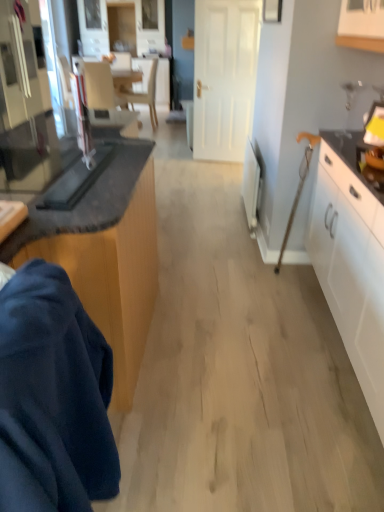
Question: From a real-world perspective, is matte gray armchair at upper left over white plastic radiator at right, the 2th appliance from the front?

Choices:
 (A) yes
 (B) no

Answer: (A)

Question: Does matte gray armchair at upper left touch white plastic radiator at right, the 2th appliance from the front?

Choices:
 (A) no
 (B) yes

Answer: (A)

Question: Is matte gray armchair at upper left behind white plastic radiator at right, the 2th appliance from the left?

Choices:
 (A) yes
 (B) no

Answer: (A)

Question: Does matte gray armchair at upper left have a larger size compared to white plastic radiator at right, the 2th appliance from the front?

Choices:
 (A) yes
 (B) no

Answer: (A)

Question: Is matte gray armchair at upper left not close to white plastic radiator at right, which is the first appliance from right to left?

Choices:
 (A) no
 (B) yes

Answer: (B)

Question: From a real-world perspective, is wooden cabinet at lower left, positioned as the first cabinetry in left-to-right order, physically located above or below light beige wood chair at upper center?

Choices:
 (A) below
 (B) above

Answer: (A)

Question: Would you say wooden cabinet at lower left, positioned as the first cabinetry in left-to-right order, is inside or outside light beige wood chair at upper center?

Choices:
 (A) outside
 (B) inside

Answer: (A)

Question: Relative to light beige wood chair at upper center, is wooden cabinet at lower left, which appears as the 2th cabinetry when viewed from the right, in front or behind?

Choices:
 (A) behind
 (B) front

Answer: (B)

Question: From their relative heights in the image, would you say wooden cabinet at lower left, positioned as the first cabinetry in left-to-right order, is taller or shorter than light beige wood chair at upper center?

Choices:
 (A) short
 (B) tall

Answer: (A)

Question: Choose the correct answer: Is matte gray armchair at upper left inside white glossy cabinet at right, which is counted as the second cabinetry, starting from the left, or outside it?

Choices:
 (A) outside
 (B) inside

Answer: (A)

Question: In the image, is matte gray armchair at upper left positioned in front of or behind white glossy cabinet at right, which is counted as the second cabinetry, starting from the left?

Choices:
 (A) front
 (B) behind

Answer: (B)

Question: From the image's perspective, is matte gray armchair at upper left located above or below white glossy cabinet at right, which is counted as the second cabinetry, starting from the left?

Choices:
 (A) below
 (B) above

Answer: (B)

Question: In terms of size, does matte gray armchair at upper left appear bigger or smaller than white glossy cabinet at right, which is counted as the second cabinetry, starting from the left?

Choices:
 (A) small
 (B) big

Answer: (A)

Question: Considering the relative positions of black glass toaster at left, the 1th appliance from the front, and matte gray armchair at upper left in the image provided, is black glass toaster at left, the 1th appliance from the front, to the left or to the right of matte gray armchair at upper left?

Choices:
 (A) right
 (B) left

Answer: (A)

Question: Is black glass toaster at left, which appears as the 2th appliance when viewed from the right, in front of or behind matte gray armchair at upper left in the image?

Choices:
 (A) behind
 (B) front

Answer: (B)